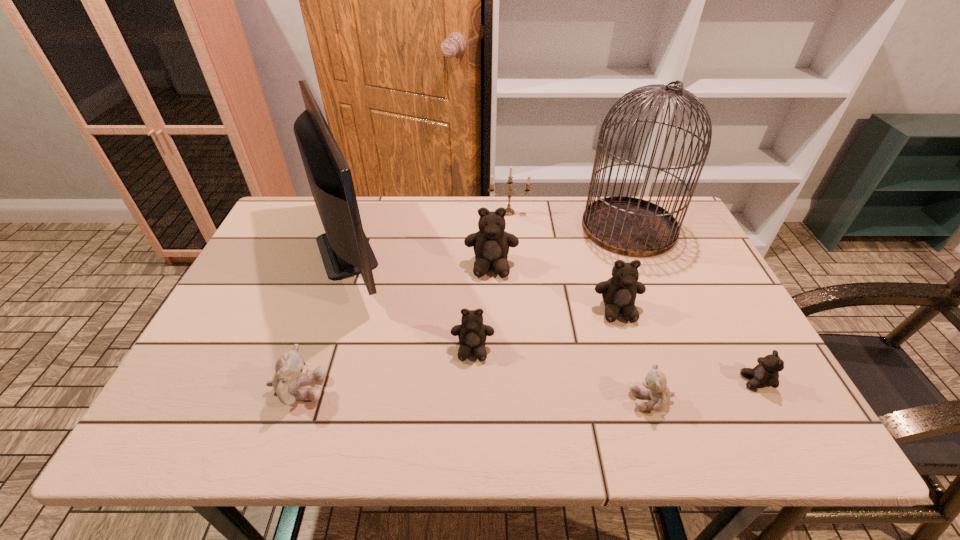
This screenshot has height=540, width=960. In the image, there is a desktop. What are the coordinates of `vacant space at the near right corner` in the screenshot? It's located at coord(726,412).

Find the location of a particular element. This screenshot has height=540, width=960. empty space between the biggest brown teddy bear and the left gray teddy bear is located at coordinates (395, 328).

Locate an element on the screen. The width and height of the screenshot is (960, 540). empty space that is in between the smallest brown teddy bear and the second nearest brown teddy bear is located at coordinates (614, 366).

Find the location of a particular element. vacant region between the biggest brown teddy bear and the bigger gray teddy bear is located at coordinates (395, 328).

The width and height of the screenshot is (960, 540). I want to click on empty space between the left gray teddy bear and the farthest teddy bear, so [395, 328].

I want to click on vacant space that is in between the third biggest brown teddy bear and the metallic candle, so click(x=491, y=281).

Find the location of a particular element. The height and width of the screenshot is (540, 960). unoccupied position between the left gray teddy bear and the farthest teddy bear is located at coordinates (395, 328).

The image size is (960, 540). In order to click on unoccupied position between the leftmost teddy bear and the smaller gray teddy bear in this screenshot , I will do `click(475, 394)`.

Where is `vacant area that lies between the computer monitor and the biggest brown teddy bear`? Image resolution: width=960 pixels, height=540 pixels. vacant area that lies between the computer monitor and the biggest brown teddy bear is located at coordinates (421, 259).

Image resolution: width=960 pixels, height=540 pixels. I want to click on vacant space that's between the smallest brown teddy bear and the bigger gray teddy bear, so click(x=527, y=385).